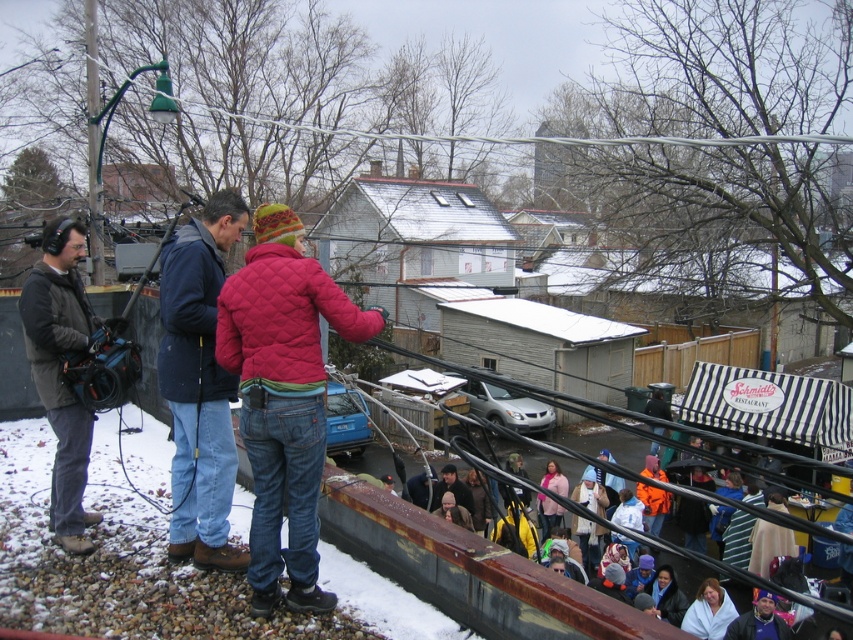
Question: Which object is positioned closest to the dark brown leather jacket at lower center?

Choices:
 (A) white fleece blanket at lower right
 (B) dark blue jacket at center
 (C) blue knit cap at lower right
 (D) dark brown leather jacket at left

Answer: (A)

Question: Can you confirm if dark blue jacket at center is smaller than dark brown leather jacket at lower center?

Choices:
 (A) no
 (B) yes

Answer: (A)

Question: Estimate the real-world distances between objects in this image. Which object is closer to the white fleece blanket at lower right?

Choices:
 (A) dark brown leather jacket at lower center
 (B) matte pink jacket at center
 (C) blue knit cap at lower right
 (D) dark blue jacket at center

Answer: (C)

Question: Where is dark brown leather jacket at left located in relation to pink matte jacket at lower center in the image?

Choices:
 (A) above
 (B) below

Answer: (A)

Question: Which point is closer to the camera?

Choices:
 (A) (747, 620)
 (B) (704, 634)
 (C) (67, 269)

Answer: (C)

Question: Is dark brown leather jacket at left to the right of pink matte jacket at lower center from the viewer's perspective?

Choices:
 (A) no
 (B) yes

Answer: (A)